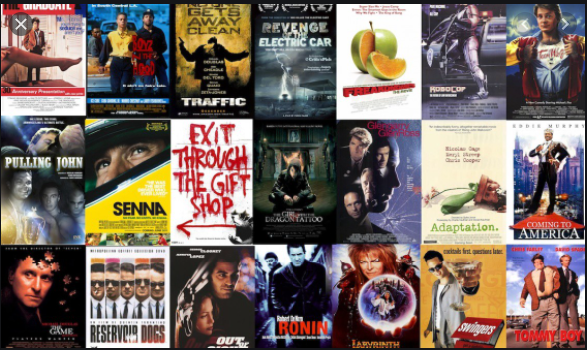
What are the coordinates of `total number of movie posters on the middle three rows` in the screenshot? It's located at (239, 314), (298, 302), (375, 296), (366, 165), (370, 52), (284, 189), (215, 182), (215, 53), (293, 56).